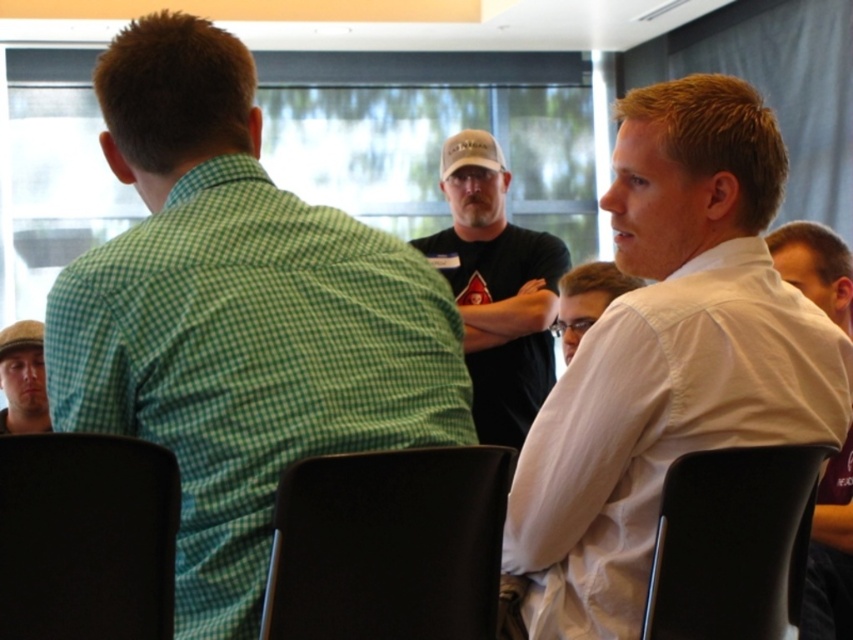
You are a photographer positioned at the entrance of the conference room. You need to capture a clear photo of both the green checkered shirt at left and the black plastic chair at lower right. Which object will appear larger in your photo?

The green checkered shirt at left will appear larger in the photo because it is closer to the viewer than the black plastic chair at lower right.

You are an interior designer assessing the layout of this conference room. You notice the dark gray cap at center and the white shirt at center. Which object has a greater width according to the scene?

The dark gray cap at center has a greater width than the white shirt at center as stated in the objects description.

You are organizing a seating arrangement for an event and need to place a small table between the black plastic chair at lower left and the white shirt at center. Which object should the table be placed closer to to ensure it fits properly?

The table should be placed closer to the black plastic chair at lower left because it has a smaller size compared to the white shirt at center, allowing for better spatial adjustment.